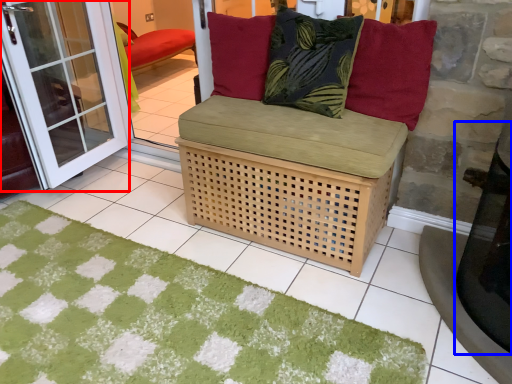
Question: Which object is further to the camera taking this photo, screen door (highlighted by a red box) or table (highlighted by a blue box)?

Choices:
 (A) screen door
 (B) table

Answer: (A)